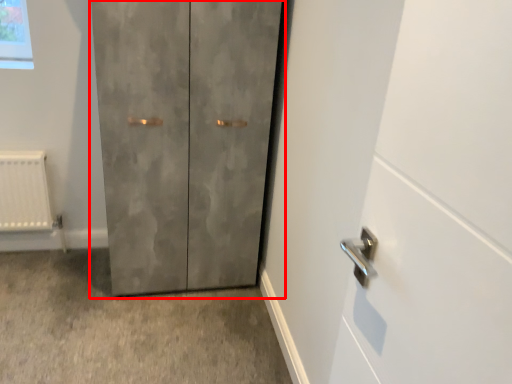
Question: From the image's perspective, where is door (annotated by the red box) located relative to concrete?

Choices:
 (A) below
 (B) above

Answer: (B)